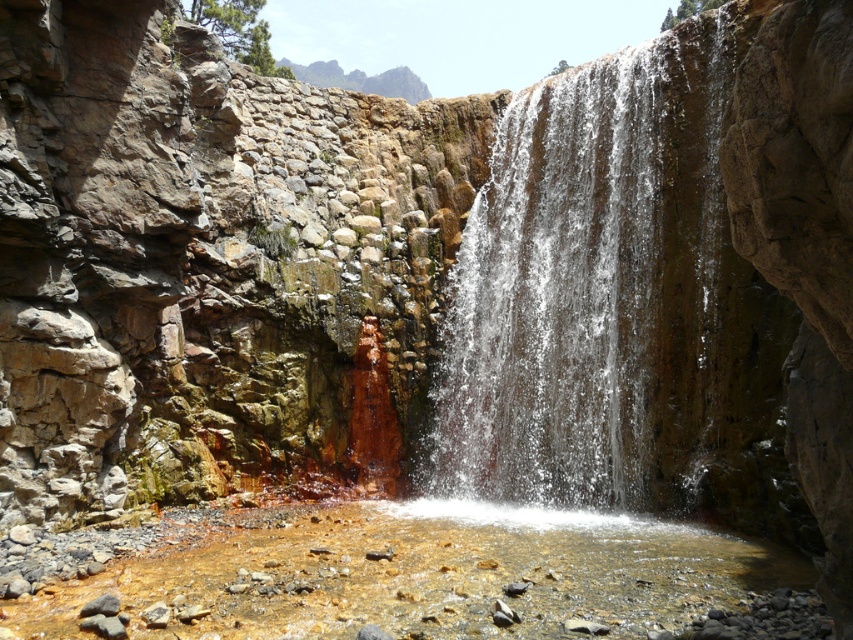
Measure the distance between point (613, 230) and camera.

Point (613, 230) is 45.43 meters away from camera.

Which is more to the right, clear water at center or translucent amber water at center?

Positioned to the right is clear water at center.

Does point (537, 372) come behind point (323, 634)?

Yes, it is.

Locate an element on the screen. This screenshot has width=853, height=640. clear water at center is located at coordinates (581, 278).